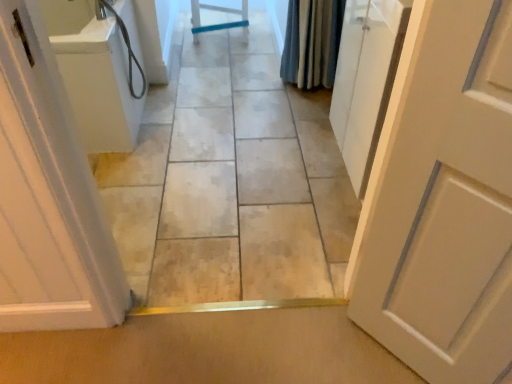
The width and height of the screenshot is (512, 384). What are the coordinates of `vacant area that is in front of blue textured fabric shower curtain at upper right` in the screenshot? It's located at coord(300,112).